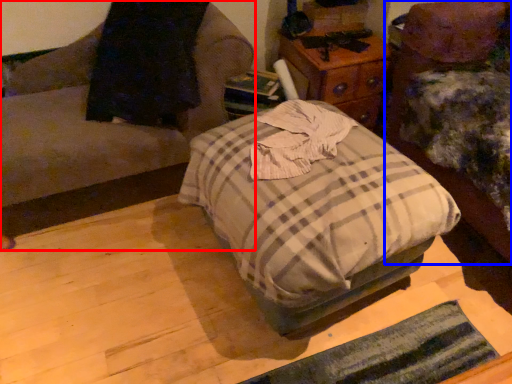
Question: Which object appears farthest to the camera in this image, furniture (highlighted by a red box) or furniture (highlighted by a blue box)?

Choices:
 (A) furniture
 (B) furniture

Answer: (A)